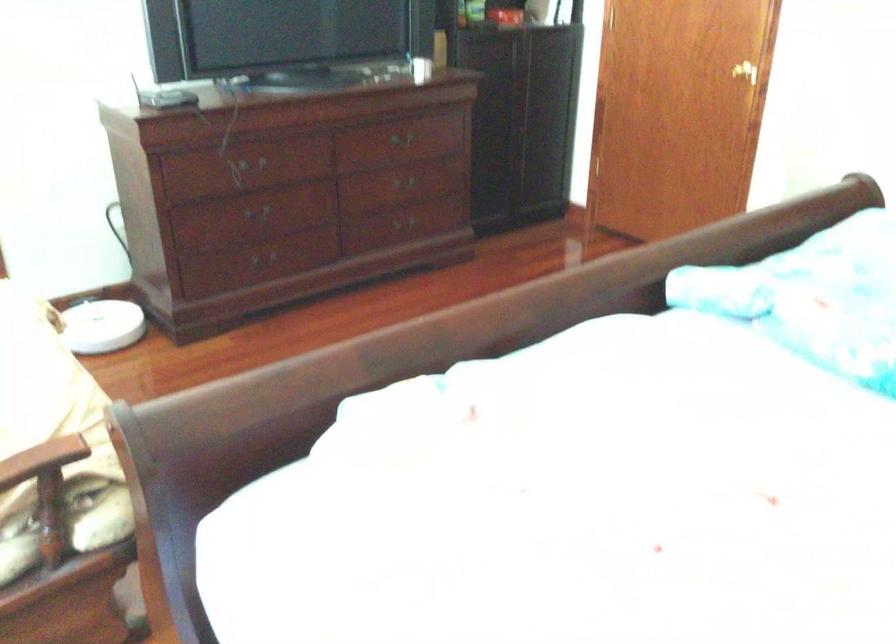
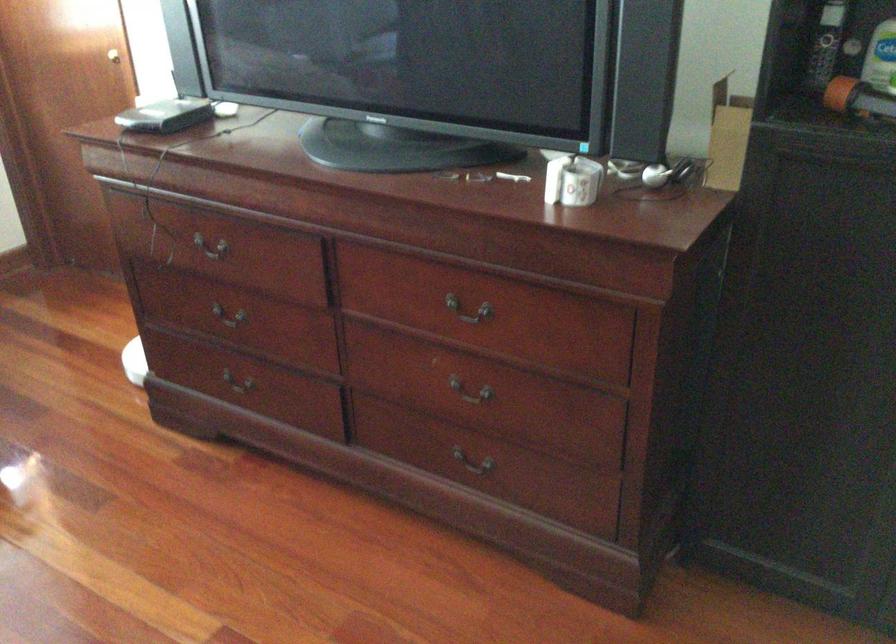
In the second image, find the point that corresponds to [237,270] in the first image.

(236, 391)